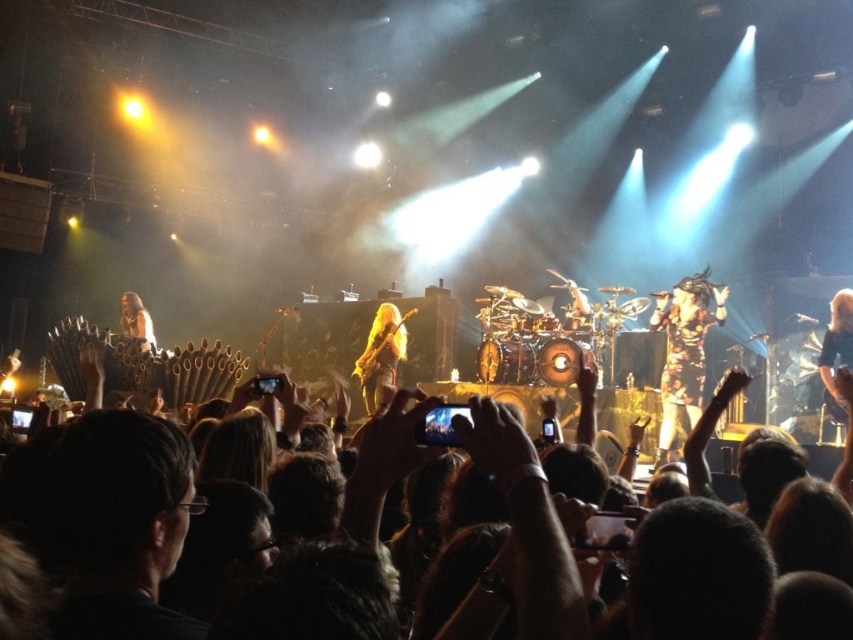
You are standing at the center of the concert stage and see two points marked in the image. The first point is at coordinates point(654, 323) and the second is at point(152, 339). Which point is closer to you?

Point(654, 323) is in front of point(152, 339), so it is closer to you.